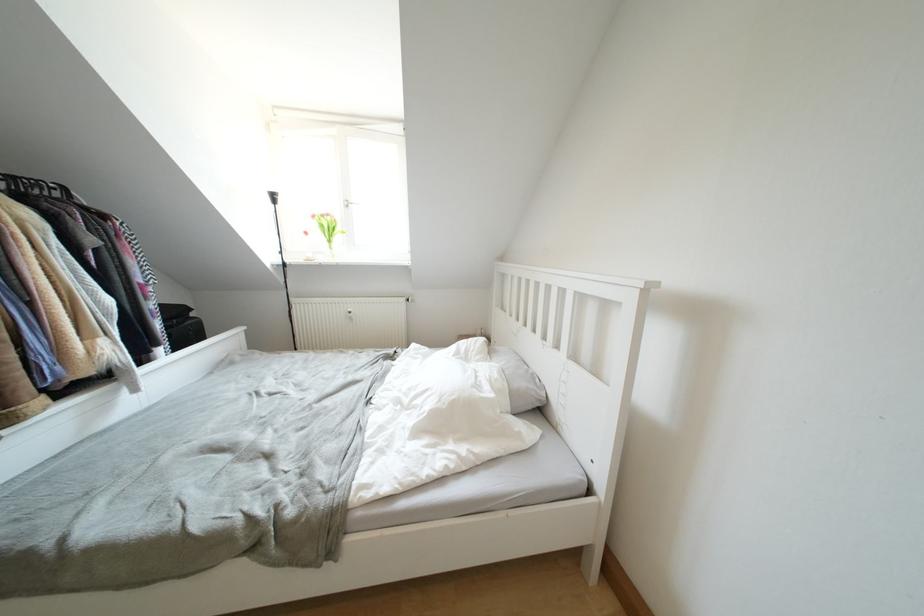
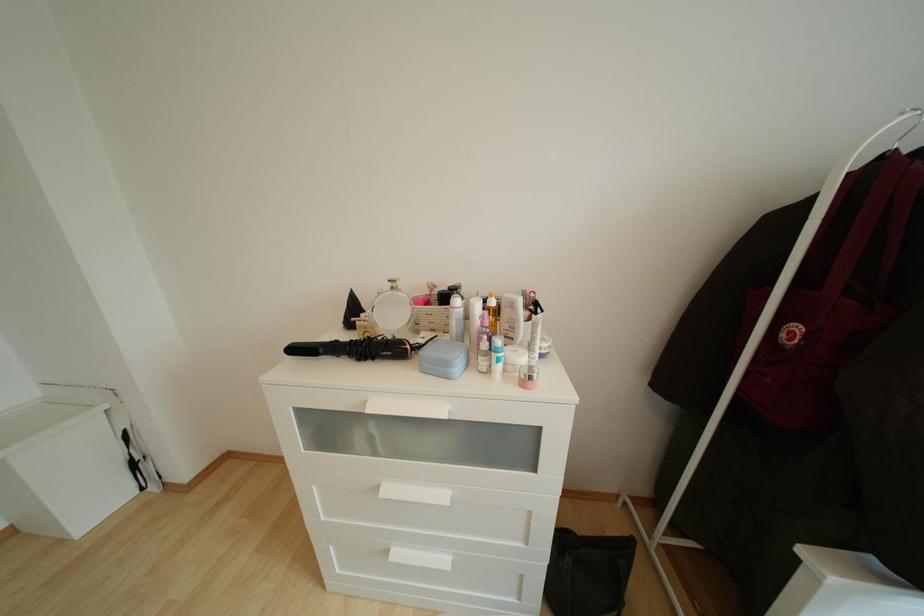
Based on the continuous images, in which direction is the camera rotating?

The rotation direction of the camera is left-down.